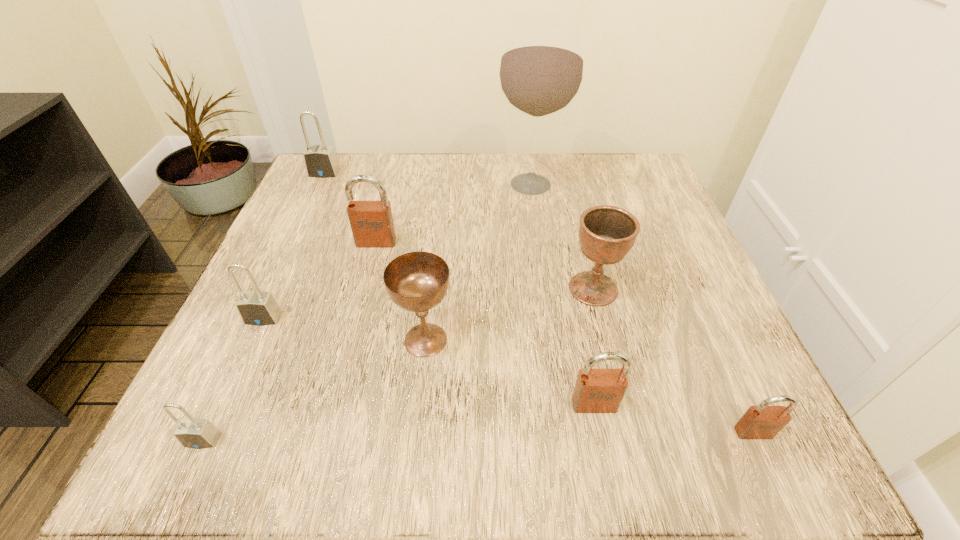
I want to click on free space at the far edge of the desktop, so click(x=556, y=209).

You are a GUI agent. You are given a task and a screenshot of the screen. Output one action in this format:
    pyautogui.click(x=<x>, y=<y>)
    Task: Click on the free spot at the near edge of the desktop
    
    Given the screenshot: What is the action you would take?
    pyautogui.click(x=516, y=434)

The height and width of the screenshot is (540, 960). I want to click on vacant area at the left edge, so click(x=292, y=330).

In the image, there is a desktop. At what (x,y) coordinates should I click in order to perform the action: click on free region at the right edge. Please return your answer as a coordinate pair (x, y). The width and height of the screenshot is (960, 540). Looking at the image, I should click on (699, 363).

Identify the location of vacant space at the near left corner of the desktop. (231, 414).

You are a GUI agent. You are given a task and a screenshot of the screen. Output one action in this format:
    pyautogui.click(x=<x>, y=<y>)
    Task: Click on the vacant space at the far right corner of the desktop
    
    Given the screenshot: What is the action you would take?
    pyautogui.click(x=616, y=197)

At what (x,y) coordinates should I click in order to perform the action: click on vacant area that lies between the rightmost object and the alcohol. Please return your answer as a coordinate pair (x, y). This screenshot has width=960, height=540. Looking at the image, I should click on (642, 308).

Identify the location of unoccupied position between the red alcohol and the fifth nearest padlock. (453, 213).

Image resolution: width=960 pixels, height=540 pixels. Find the location of `empty space between the tallest object and the second smallest brown padlock`. empty space between the tallest object and the second smallest brown padlock is located at coordinates (x=563, y=294).

Locate an element on the screen. The width and height of the screenshot is (960, 540). empty location between the red alcohol and the smallest gray padlock is located at coordinates (367, 312).